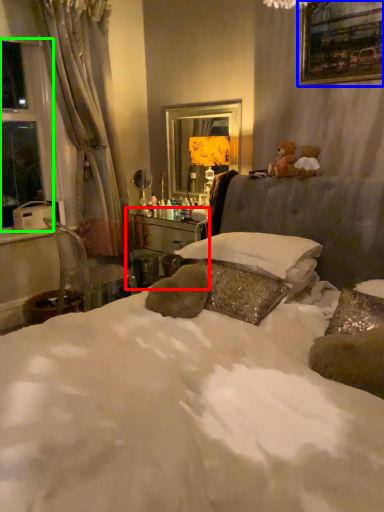
Question: Estimate the real-world distances between objects in this image. Which object is farther from vanity (highlighted by a red box), picture frame (highlighted by a blue box) or window (highlighted by a green box)?

Choices:
 (A) picture frame
 (B) window

Answer: (A)